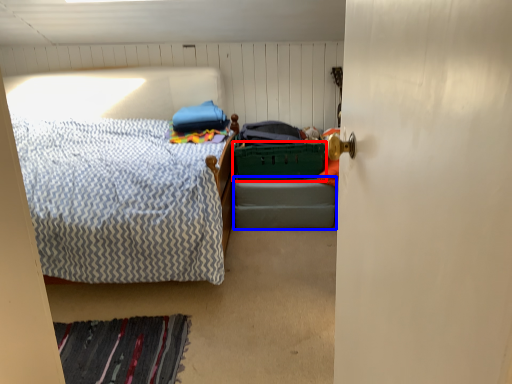
Question: Which object is further to the camera taking this photo, laundry basket (highlighted by a red box) or bed frame (highlighted by a blue box)?

Choices:
 (A) laundry basket
 (B) bed frame

Answer: (B)